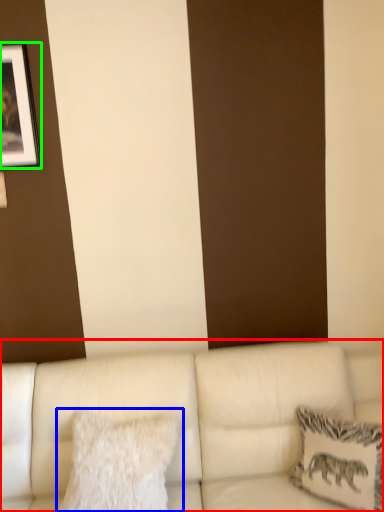
Question: Which object is positioned closest to studio couch (highlighted by a red box)? Select from pillow (highlighted by a blue box) and picture frame (highlighted by a green box).

Choices:
 (A) pillow
 (B) picture frame

Answer: (A)